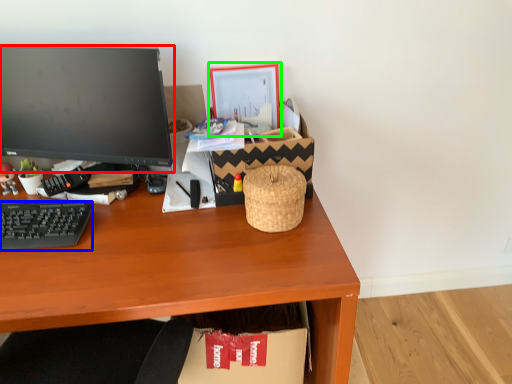
Question: Estimate the real-world distances between objects in this image. Which object is farther from computer monitor (highlighted by a red box), computer keyboard (highlighted by a blue box) or picture frame (highlighted by a green box)?

Choices:
 (A) computer keyboard
 (B) picture frame

Answer: (B)